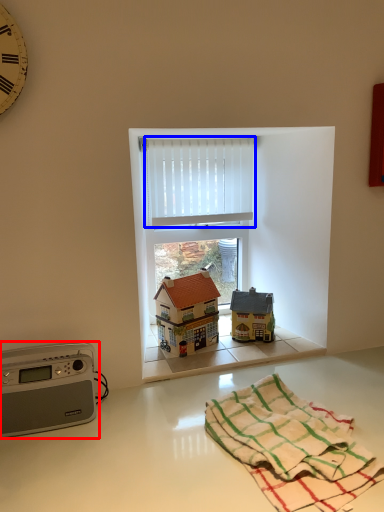
Question: Which object is closer to the camera taking this photo, appliance (highlighted by a red box) or curtain (highlighted by a blue box)?

Choices:
 (A) appliance
 (B) curtain

Answer: (A)